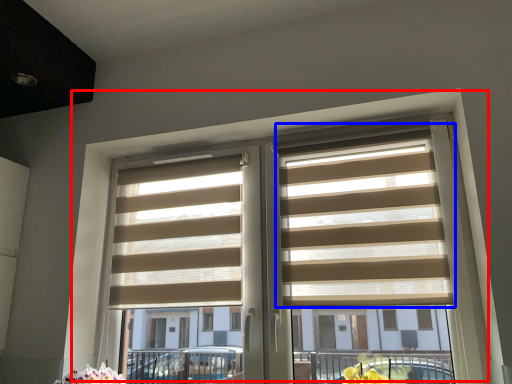
Question: Among these objects, which one is farthest to the camera, window (highlighted by a red box) or blind (highlighted by a blue box)?

Choices:
 (A) window
 (B) blind

Answer: (B)